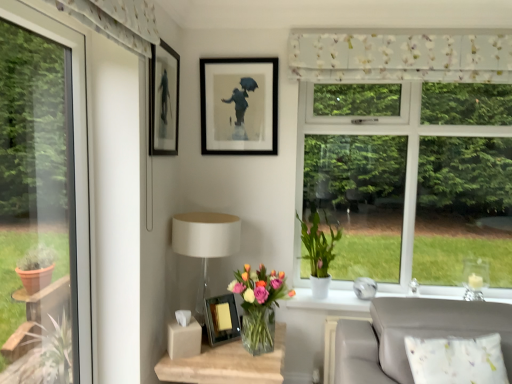
Question: Is translucent glass vase at lower center, the 2th houseplant when ordered from right to left, in contact with floral fabric curtain at upper center?

Choices:
 (A) no
 (B) yes

Answer: (A)

Question: From a real-world perspective, is translucent glass vase at lower center, the 2th houseplant when ordered from right to left, on top of floral fabric curtain at upper center?

Choices:
 (A) yes
 (B) no

Answer: (B)

Question: Is floral fabric curtain at upper center at the back of translucent glass vase at lower center, the 2th houseplant when ordered from right to left?

Choices:
 (A) yes
 (B) no

Answer: (B)

Question: Considering the relative positions of translucent glass vase at lower center, arranged as the 1th houseplant when viewed from the front, and floral fabric curtain at upper center in the image provided, is translucent glass vase at lower center, arranged as the 1th houseplant when viewed from the front, in front of floral fabric curtain at upper center?

Choices:
 (A) yes
 (B) no

Answer: (A)

Question: Does translucent glass vase at lower center, which is the first houseplant from left to right, come behind floral fabric curtain at upper center?

Choices:
 (A) yes
 (B) no

Answer: (B)

Question: Is translucent glass vase at lower center, the second houseplant when ordered from back to front, located outside floral fabric curtain at upper center?

Choices:
 (A) yes
 (B) no

Answer: (A)

Question: Does floral fabric curtain at upper center come behind matte black frame at upper center, the 3th picture frame ordered from the bottom?

Choices:
 (A) yes
 (B) no

Answer: (B)

Question: From a real-world perspective, is floral fabric curtain at upper center positioned over matte black frame at upper center, placed as the first picture frame when sorted from top to bottom, based on gravity?

Choices:
 (A) no
 (B) yes

Answer: (B)

Question: Can matte black frame at upper center, placed as the first picture frame when sorted from top to bottom, be found inside floral fabric curtain at upper center?

Choices:
 (A) yes
 (B) no

Answer: (B)

Question: Does floral fabric curtain at upper center have a larger size compared to matte black frame at upper center, the 3th picture frame ordered from the bottom?

Choices:
 (A) no
 (B) yes

Answer: (B)

Question: Is floral fabric curtain at upper center taller than matte black frame at upper center, the 3th picture frame ordered from the bottom?

Choices:
 (A) no
 (B) yes

Answer: (A)

Question: Is floral fabric curtain at upper center turned away from matte black frame at upper center, placed as the first picture frame when sorted from top to bottom?

Choices:
 (A) no
 (B) yes

Answer: (A)

Question: Is floral fabric curtain at upper center at the left side of white matte pot at window, arranged as the first houseplant when viewed from the right?

Choices:
 (A) no
 (B) yes

Answer: (A)